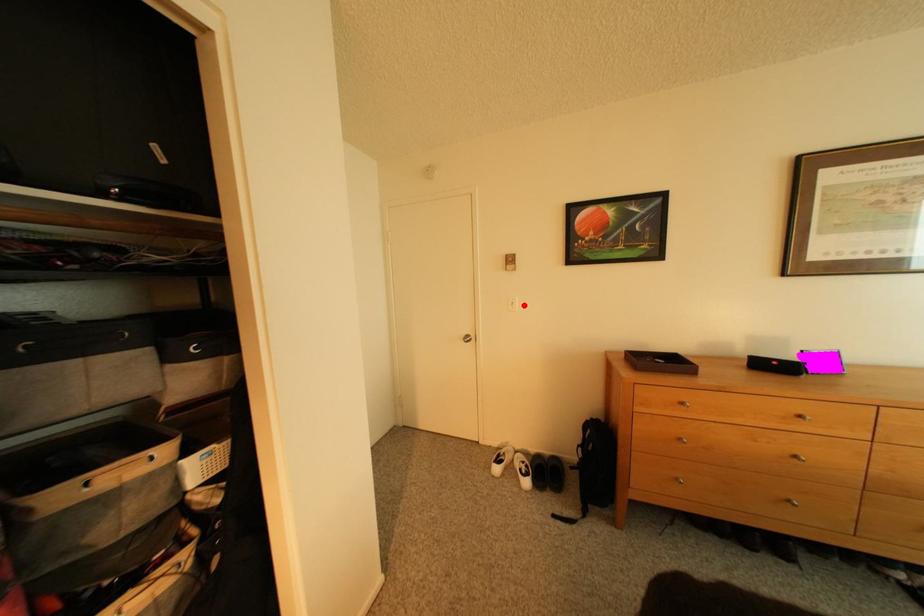
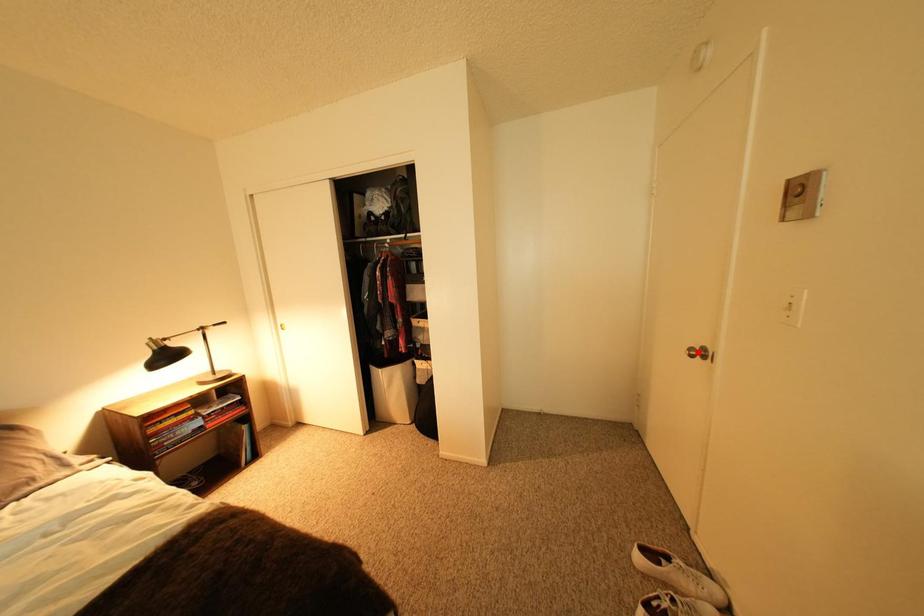
I am providing you with two images of the same scene from different viewpoints. A red point is marked on the first image and another point is marked on the second image. Do the highlighted points in image1 and image2 indicate the same real-world spot?

No